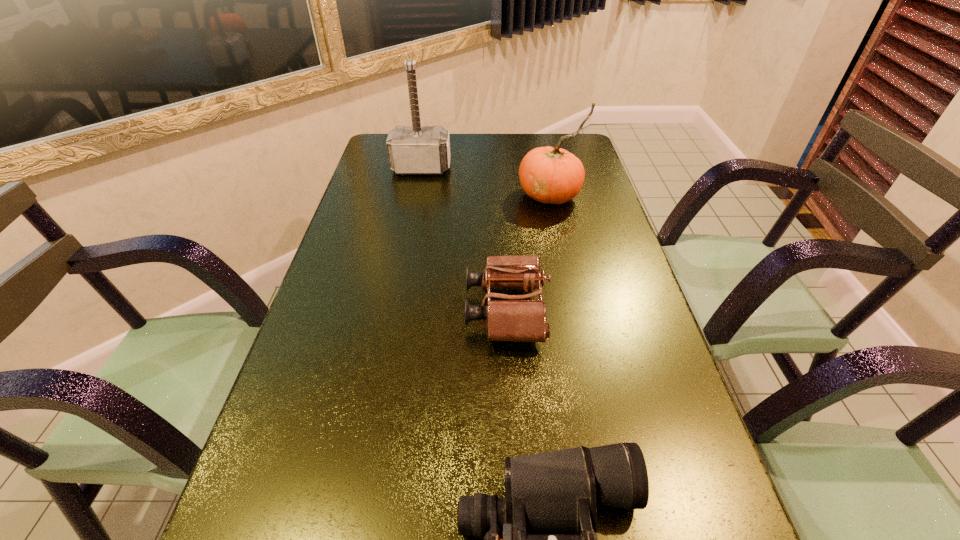
Where is `hammer`? The image size is (960, 540). hammer is located at coordinates (416, 149).

I want to click on the farthest object, so click(x=416, y=149).

Where is `pumpkin`? pumpkin is located at coordinates (551, 175).

Where is `the second farthest object`? Image resolution: width=960 pixels, height=540 pixels. the second farthest object is located at coordinates (551, 175).

You are a GUI agent. You are given a task and a screenshot of the screen. Output one action in this format:
    pyautogui.click(x=<x>, y=<y>)
    Task: Click on the farther binoculars
    
    Given the screenshot: What is the action you would take?
    pyautogui.click(x=515, y=319)

Locate an element on the screen. the third tallest object is located at coordinates (515, 319).

The height and width of the screenshot is (540, 960). I want to click on vacant region located for striking with the head of the hammer, so click(411, 223).

At what (x,y) coordinates should I click in order to perform the action: click on vacant point located on the left of the pumpkin. Please return your answer as a coordinate pair (x, y). This screenshot has height=540, width=960. Looking at the image, I should click on (497, 195).

This screenshot has height=540, width=960. What are the coordinates of `vacant space located 0.210m through the eyepieces of the second shortest object` in the screenshot? It's located at (372, 310).

Find the location of a particular element. This screenshot has height=540, width=960. vacant space positioned through the eyepieces of the second shortest object is located at coordinates (394, 310).